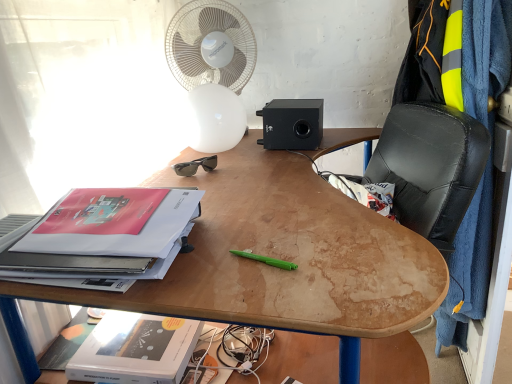
What are the coordinates of `space that is in front of black plastic sunglasses at upper center` in the screenshot? It's located at (210, 180).